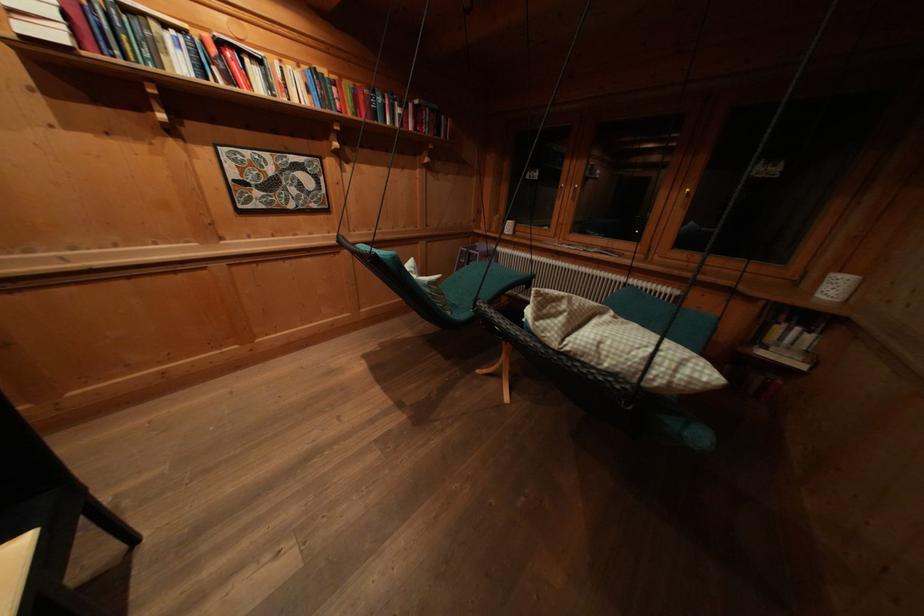
You are a GUI agent. You are given a task and a screenshot of the screen. Output one action in this format:
    pyautogui.click(x=<x>, y=<y>)
    Task: Click on the white cylindrical holder
    This screenshot has height=616, width=924.
    Given the screenshot: What is the action you would take?
    pyautogui.click(x=837, y=286)